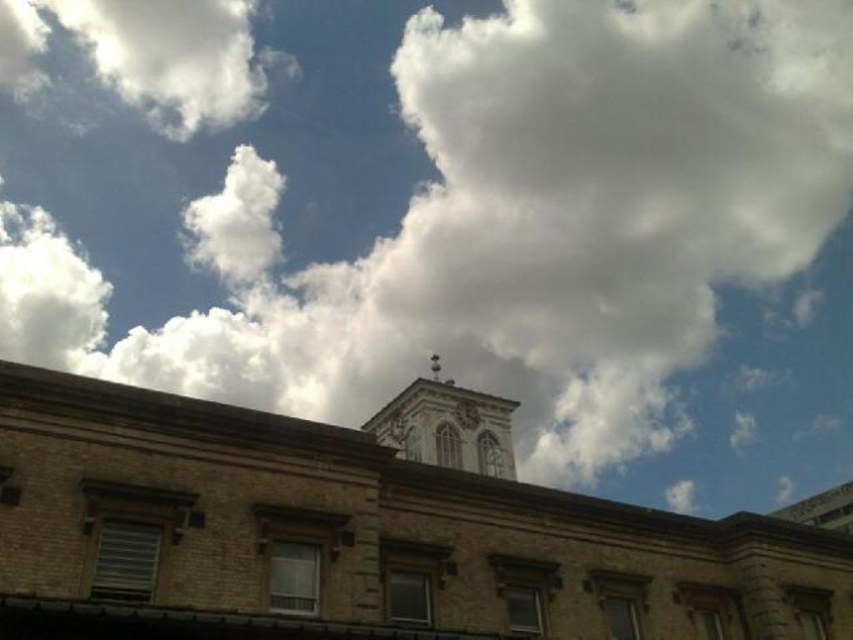
Question: Can you confirm if brown brick church at center is positioned to the left of smooth stone bell tower at center?

Choices:
 (A) no
 (B) yes

Answer: (A)

Question: Is brown brick church at center to the right of smooth stone bell tower at center from the viewer's perspective?

Choices:
 (A) no
 (B) yes

Answer: (B)

Question: Is brown brick church at center below smooth stone bell tower at center?

Choices:
 (A) yes
 (B) no

Answer: (A)

Question: Among these objects, which one is nearest to the camera?

Choices:
 (A) smooth stone bell tower at center
 (B) brown brick church at center

Answer: (B)

Question: Which of the following is the farthest from the observer?

Choices:
 (A) brown brick church at center
 (B) smooth stone bell tower at center

Answer: (B)